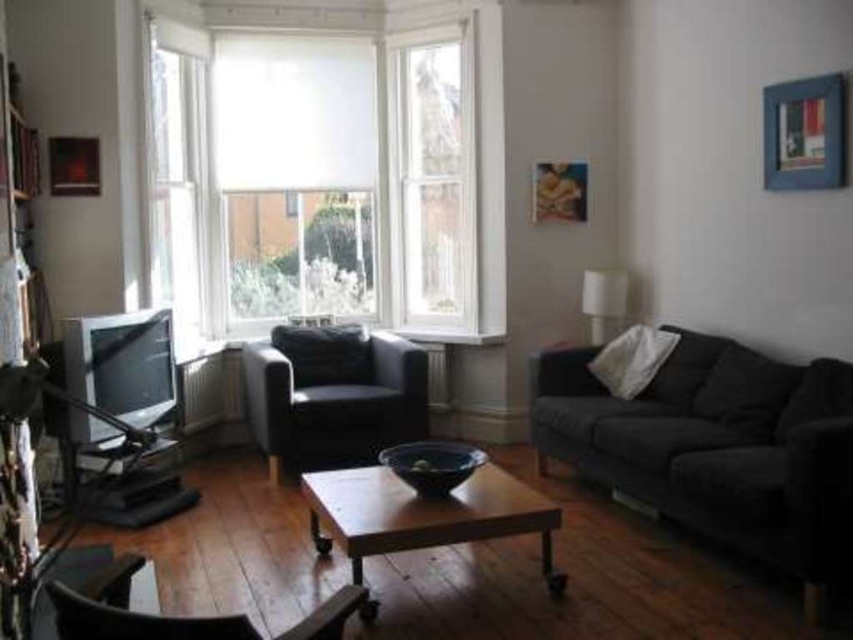
Consider the image. You are a visitor entering the living room and want to sit down. Which object, the dark gray fabric couch at right or the matte black chair at lower left, is taller and thus might be easier to sit on?

The dark gray fabric couch at right is taller than the matte black chair at lower left, so it might be easier to sit on.

You are sitting on the matte black chair at lower left and want to place a book on the wooden coffee table at center. Is the coffee table within easy reach from your current position?

The wooden coffee table at center is below the matte black chair at lower left, so yes, it is within easy reach from the chair.

You are standing in the living room and want to move from the point at coordinates point (466, 490) to the point at coordinates point (238, 618). Which direction should you move?

You should move forward because point (466, 490) is behind point (238, 618), so moving forward from point (466, 490) will take you towards point (238, 618).